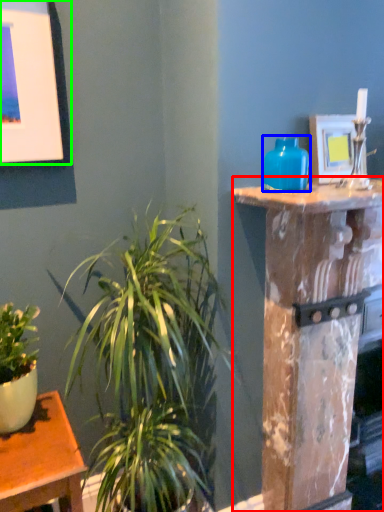
Question: Which object is the farthest from pillar (highlighted by a red box)? Choose among these: vase (highlighted by a blue box) or picture frame (highlighted by a green box).

Choices:
 (A) vase
 (B) picture frame

Answer: (B)